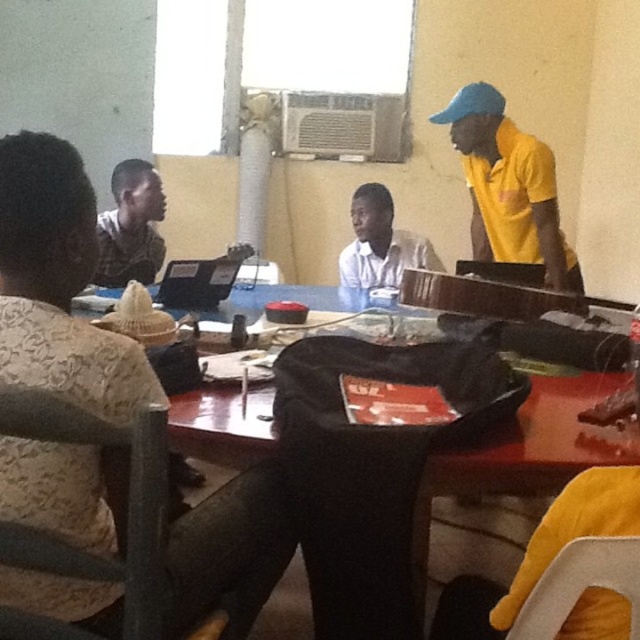
You are a delivery person who needs to place a small package on the table between the patterned fabric shirt at left and the black fabric bag at center. The package is 18 inches long. Will it fit between them without overlapping either item?

The distance between the patterned fabric shirt at left and the black fabric bag at center is 19.15 inches. Since the package is 18 inches long, it will fit between them without overlapping either item.

You are organizing the items on the table and need to place the patterned fabric shirt at left and the black fabric bag at center into a storage box. Which item should you place first to ensure both fit properly?

The patterned fabric shirt at left should be placed first since it is above the black fabric bag at center, indicating it might be on top and easier to access.

You are standing at the entrance of the room and want to locate the person wearing the matte black shirt at center. Based on the coordinates provided, in which direction should you look relative to the entrance?

The matte black shirt at center is located at coordinates point (x=131, y=227), so you should look towards the center of the room from the entrance.